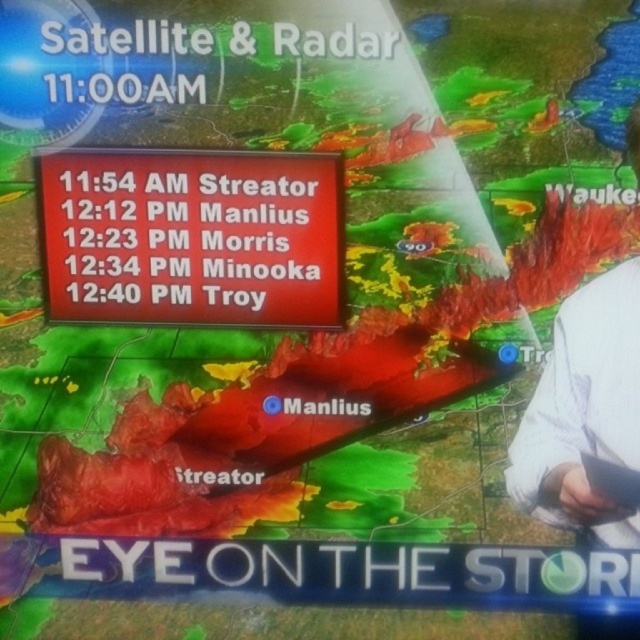
Question: Considering the relative positions of red matte sign at center and white fabric shirt at right in the image provided, where is red matte sign at center located with respect to white fabric shirt at right?

Choices:
 (A) above
 (B) below

Answer: (A)

Question: Which of the following is the closest to the observer?

Choices:
 (A) white fabric shirt at right
 (B) red matte sign at center

Answer: (A)

Question: Is red matte sign at center wider than white fabric shirt at right?

Choices:
 (A) no
 (B) yes

Answer: (B)

Question: Is red matte sign at center above white fabric shirt at right?

Choices:
 (A) no
 (B) yes

Answer: (B)